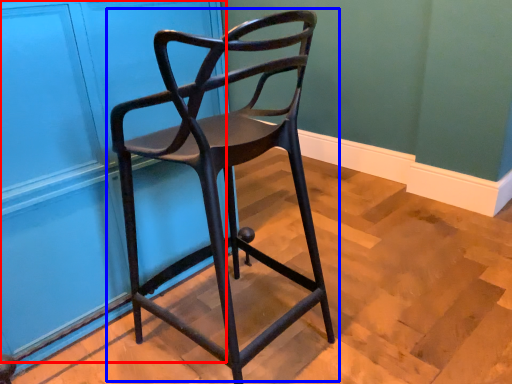
Question: Which object is further to the camera taking this photo, door (highlighted by a red box) or chair (highlighted by a blue box)?

Choices:
 (A) door
 (B) chair

Answer: (A)